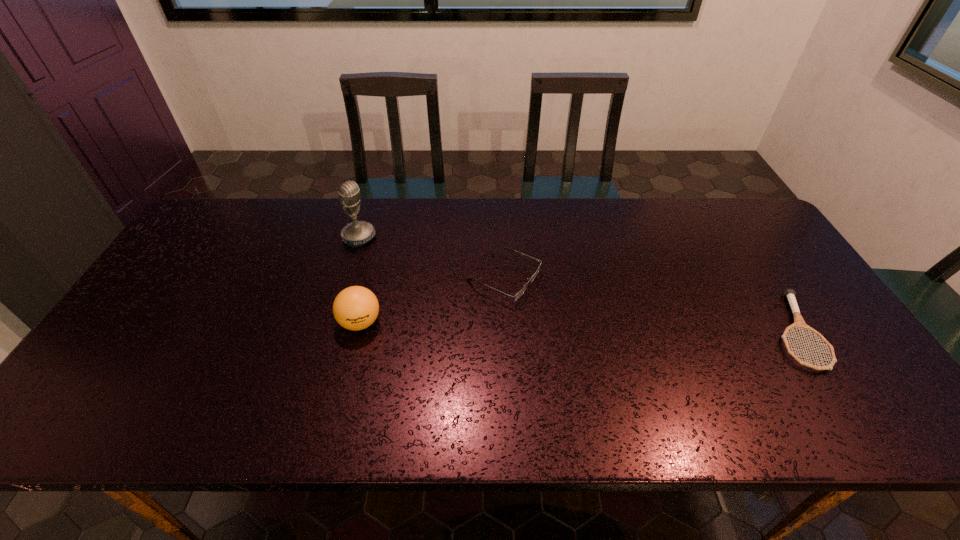
The width and height of the screenshot is (960, 540). Identify the location of vacant space on the desktop that is between the third shortest object and the rightmost object and is positioned on the front-facing side of the tallest object. (513, 326).

You are a GUI agent. You are given a task and a screenshot of the screen. Output one action in this format:
    pyautogui.click(x=<x>, y=<y>)
    Task: Click on the vacant space on the desktop that is between the ping-pong ball and the shortest object and is positioned on the front-facing side of the third tallest object
    This screenshot has width=960, height=540.
    Given the screenshot: What is the action you would take?
    [613, 327]